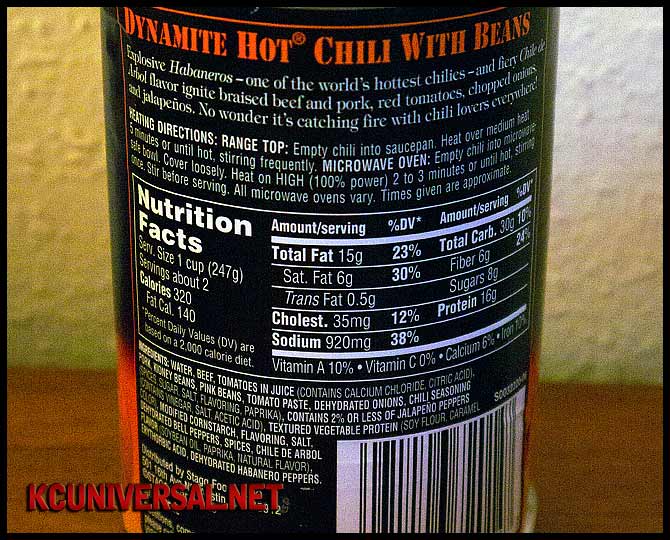
At what (x,y) coordinates should I click in order to perform the action: click on brown wooden floor. Please return your answer as a coordinate pair (x, y). The width and height of the screenshot is (670, 540). Looking at the image, I should click on (86, 431).